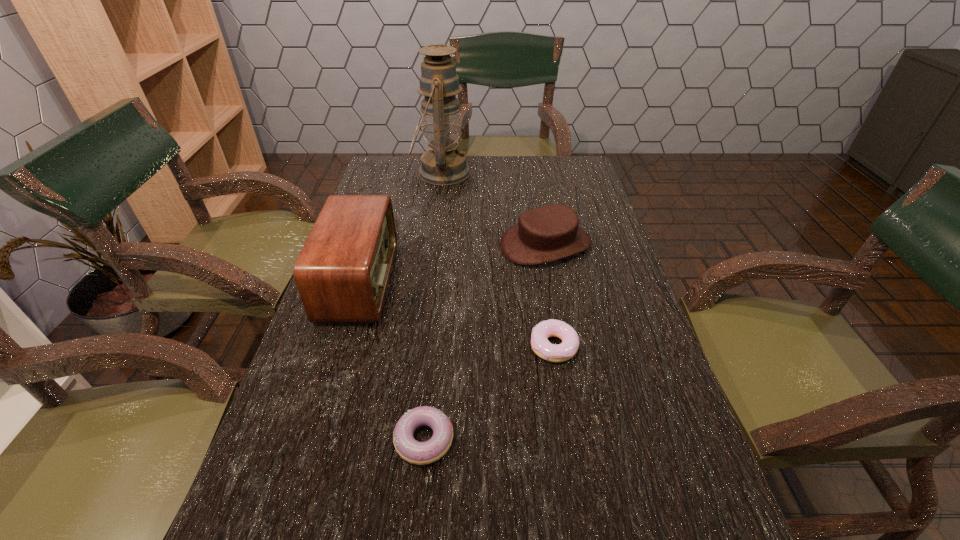
Identify the location of free region located on the front of the third tallest object. The width and height of the screenshot is (960, 540). (562, 329).

Locate an element on the screen. This screenshot has height=540, width=960. vacant space positioned 0.300m on the back of the farther doughnut is located at coordinates (538, 248).

Identify the location of vacant space situated on the back of the nearer doughnut. The width and height of the screenshot is (960, 540). pos(432,362).

This screenshot has width=960, height=540. Find the location of `object present at the far edge`. object present at the far edge is located at coordinates (445, 164).

The width and height of the screenshot is (960, 540). I want to click on oil lamp at the left edge, so click(x=445, y=164).

The width and height of the screenshot is (960, 540). What are the coordinates of `radio receiver located in the left edge section of the desktop` in the screenshot? It's located at (342, 273).

Image resolution: width=960 pixels, height=540 pixels. I want to click on object present at the right edge, so click(x=549, y=233).

Where is `object present at the far left corner`? This screenshot has width=960, height=540. object present at the far left corner is located at coordinates (445, 164).

In the image, there is a desktop. Where is `free space at the left edge`? Image resolution: width=960 pixels, height=540 pixels. free space at the left edge is located at coordinates (311, 423).

In the image, there is a desktop. In order to click on blank space at the right edge in this screenshot , I will do `click(574, 312)`.